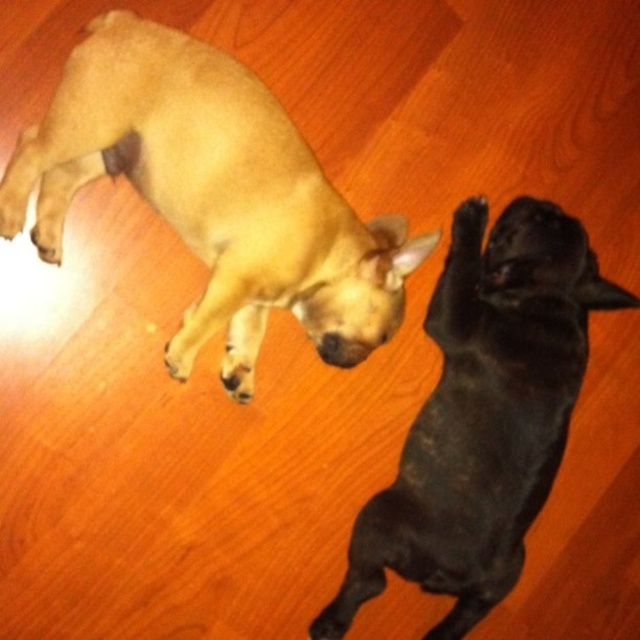
Question: Which object is farther from the camera taking this photo?

Choices:
 (A) black matte dog at upper right
 (B) light brown fur dog at upper left

Answer: (A)

Question: Can you confirm if light brown fur dog at upper left is positioned to the right of black matte dog at upper right?

Choices:
 (A) no
 (B) yes

Answer: (A)

Question: Considering the relative positions of light brown fur dog at upper left and black matte dog at upper right in the image provided, where is light brown fur dog at upper left located with respect to black matte dog at upper right?

Choices:
 (A) above
 (B) below

Answer: (A)

Question: Which object is closer to the camera taking this photo?

Choices:
 (A) black matte dog at upper right
 (B) light brown fur dog at upper left

Answer: (B)

Question: Which point is farther from the camera taking this photo?

Choices:
 (A) (26, 177)
 (B) (348, 602)

Answer: (B)

Question: Is light brown fur dog at upper left bigger than black matte dog at upper right?

Choices:
 (A) no
 (B) yes

Answer: (B)